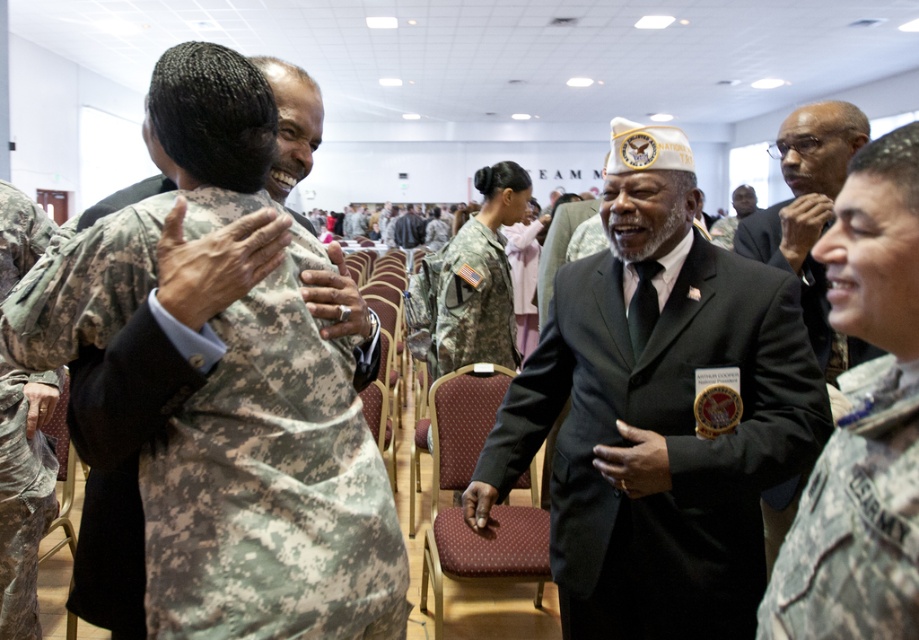
Does camouflage uniform at left have a lesser height compared to camouflage fabric uniform at lower right?

No, camouflage uniform at left is not shorter than camouflage fabric uniform at lower right.

Which of these two, camouflage uniform at left or camouflage fabric uniform at lower right, stands shorter?

camouflage fabric uniform at lower right is shorter.

Which is in front, point (200, 195) or point (889, 596)?

Point (889, 596) is in front.

I want to click on camouflage uniform at left, so click(233, 392).

Who is higher up, camouflage uniform at left or camouflage fabric uniform at center?

camouflage fabric uniform at center is higher up.

Measure the distance between point (x=356, y=465) and camera.

Point (x=356, y=465) and camera are 3.92 feet apart from each other.

The width and height of the screenshot is (919, 640). Identify the location of camouflage uniform at left. (233, 392).

Locate an element on the screen. camouflage uniform at left is located at coordinates (233, 392).

Which of these two, camouflage uniform at left or dark gray suit at center, stands shorter?

A: dark gray suit at center is shorter.

Between point (332, 618) and point (817, 333), which one is positioned behind?

The point (817, 333) is behind.

The image size is (919, 640). I want to click on camouflage uniform at left, so pyautogui.click(x=233, y=392).